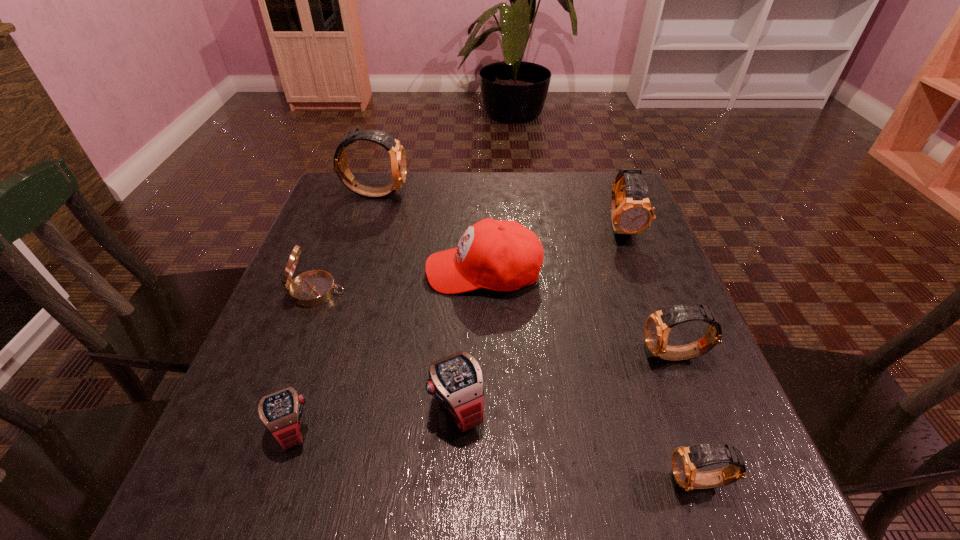
Find the location of a particular element. the leftmost gold watch is located at coordinates (397, 153).

Locate an element on the screen. This screenshot has width=960, height=540. the biggest gold watch is located at coordinates (397, 153).

Locate an element on the screen. Image resolution: width=960 pixels, height=540 pixels. the second tallest object is located at coordinates (631, 212).

Find the location of a particular element. The height and width of the screenshot is (540, 960). the second farthest object is located at coordinates (631, 212).

This screenshot has width=960, height=540. In order to click on baseball cap in this screenshot , I will do `click(501, 255)`.

Where is `the third farthest gold watch`? This screenshot has height=540, width=960. the third farthest gold watch is located at coordinates (658, 324).

This screenshot has height=540, width=960. Identify the location of the third biggest gold watch. (658, 324).

You are a GUI agent. You are given a task and a screenshot of the screen. Output one action in this format:
    pyautogui.click(x=<x>, y=<y>)
    Task: Click on the compass
    This screenshot has height=540, width=960.
    Given the screenshot: What is the action you would take?
    pyautogui.click(x=312, y=288)

Identify the location of the bigger red watch. (456, 381).

Identify the location of the right red watch. Image resolution: width=960 pixels, height=540 pixels. (456, 381).